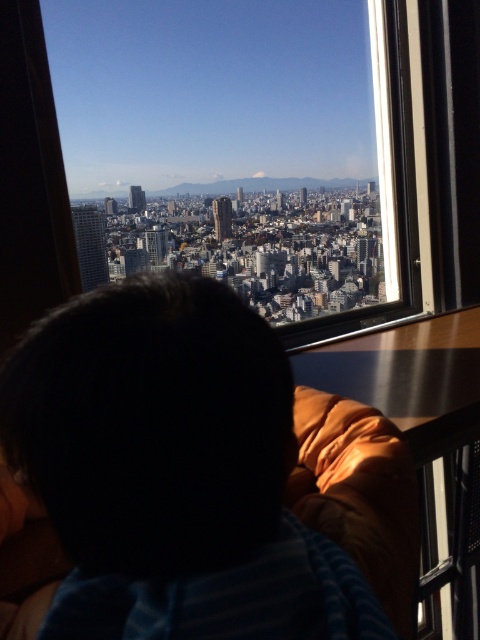
You are an interior designer assessing the view from a living room. You see the transparent glass window at center and the dark hair at center. Which object is closer to the viewer?

The transparent glass window at center is closer to the viewer because it is positioned over the dark hair at center, indicating it is in front.

You are an interior designer assessing the view from a living room. You notice the transparent glass window at center and the dark hair at center. Which object is taller in the scene?

The transparent glass window at center is taller than the dark hair at center.